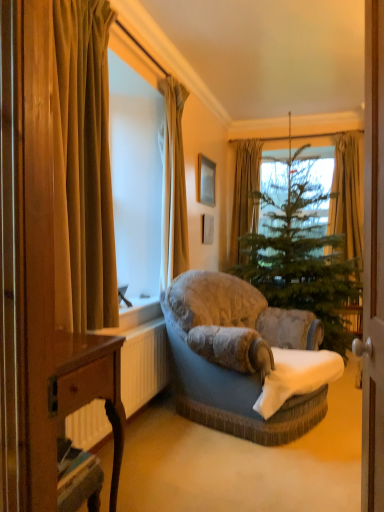
Question: From a real-world perspective, is velvet gold curtain at left, which is counted as the first curtain, starting from the front, beneath green fabric curtain at upper center, the 4th curtain positioned from the front?

Choices:
 (A) yes
 (B) no

Answer: (A)

Question: From the image's perspective, is velvet gold curtain at left, which is counted as the first curtain, starting from the front, over green fabric curtain at upper center, the first curtain positioned from the back?

Choices:
 (A) no
 (B) yes

Answer: (A)

Question: From a real-world perspective, is velvet gold curtain at left, marked as the first curtain in a left-to-right arrangement, physically above green fabric curtain at upper center, the third curtain positioned from the left?

Choices:
 (A) yes
 (B) no

Answer: (B)

Question: Does velvet gold curtain at left, which is counted as the first curtain, starting from the front, turn towards green fabric curtain at upper center, the 4th curtain positioned from the front?

Choices:
 (A) no
 (B) yes

Answer: (A)

Question: Considering the relative sizes of velvet gold curtain at left, the fourth curtain viewed from the back, and green fabric curtain at upper center, the first curtain positioned from the back, in the image provided, is velvet gold curtain at left, the fourth curtain viewed from the back, bigger than green fabric curtain at upper center, the first curtain positioned from the back,?

Choices:
 (A) no
 (B) yes

Answer: (B)

Question: Is point pyautogui.click(x=203, y=159) closer or farther from the camera than point pyautogui.click(x=67, y=432)?

Choices:
 (A) closer
 (B) farther

Answer: (B)

Question: From a real-world perspective, is wooden picture frame at upper center physically located above or below white plastic radiator at lower left?

Choices:
 (A) below
 (B) above

Answer: (B)

Question: Which is correct: wooden picture frame at upper center is inside white plastic radiator at lower left, or outside of it?

Choices:
 (A) outside
 (B) inside

Answer: (A)

Question: Considering their positions, is wooden picture frame at upper center located in front of or behind white plastic radiator at lower left?

Choices:
 (A) behind
 (B) front

Answer: (A)

Question: Is green fabric curtain at upper center, the first curtain positioned from the back, situated inside green fabric curtain at upper right, the 4th curtain when ordered from left to right, or outside?

Choices:
 (A) outside
 (B) inside

Answer: (A)

Question: From a real-world perspective, is green fabric curtain at upper center, the third curtain positioned from the left, positioned above or below green fabric curtain at upper right, the 4th curtain when ordered from left to right?

Choices:
 (A) below
 (B) above

Answer: (A)

Question: Does point (235, 229) appear closer or farther from the camera than point (332, 211)?

Choices:
 (A) farther
 (B) closer

Answer: (A)

Question: From the image's perspective, is green fabric curtain at upper center, placed as the second curtain when sorted from right to left, positioned above or below green fabric curtain at upper right, placed as the 3th curtain when sorted from front to back?

Choices:
 (A) below
 (B) above

Answer: (A)

Question: From a real-world perspective, relative to wooden desk at lower left, is green fabric curtain at upper center, the third curtain positioned from the left, vertically above or below?

Choices:
 (A) below
 (B) above

Answer: (B)

Question: Does point (235, 208) appear closer or farther from the camera than point (109, 346)?

Choices:
 (A) closer
 (B) farther

Answer: (B)